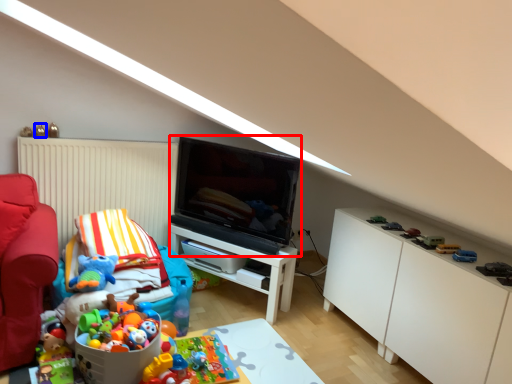
Question: Which point is further to the camera, television (highlighted by a red box) or toy (highlighted by a blue box)?

Choices:
 (A) television
 (B) toy

Answer: (B)